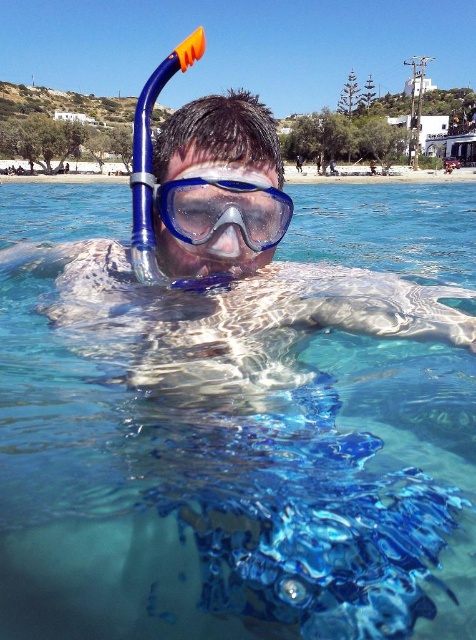
You are a photographer standing at the camera position. You want to take a photo of the snorkeler but need to ensure they are within the focus range of your lens, which can focus as close as 3 meters. Is the point where the snorkeler is located at point (60, 397) within the focus range?

The distance of point (60, 397) from the camera is 3.87 meters. Since the minimum focus distance of the lens is 3 meters, the snorkeler at point (60, 397) is within the focus range as 3.87 meters is greater than 3 meters.